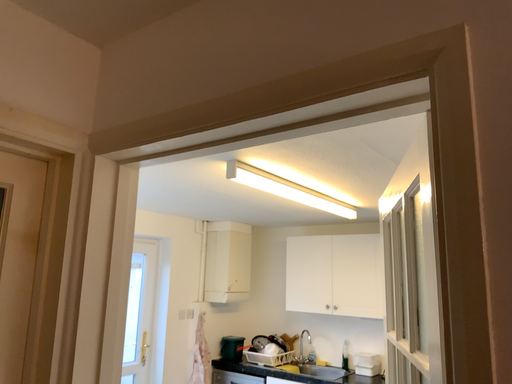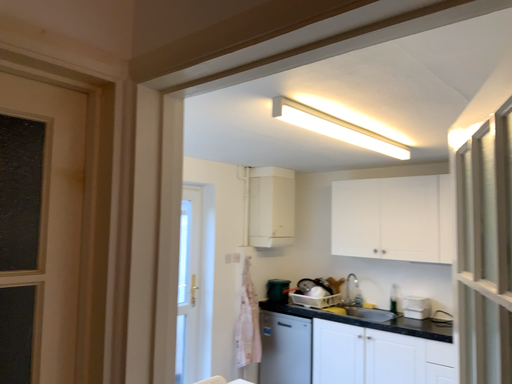
Question: How did the camera likely rotate when shooting the video?

Choices:
 (A) rotated upward
 (B) rotated downward

Answer: (B)